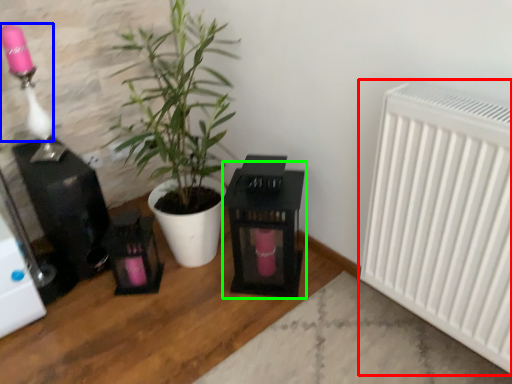
Question: Which is nearer to the radiator (highlighted by a red box)? lamp (highlighted by a blue box) or table (highlighted by a green box).

Choices:
 (A) lamp
 (B) table

Answer: (B)